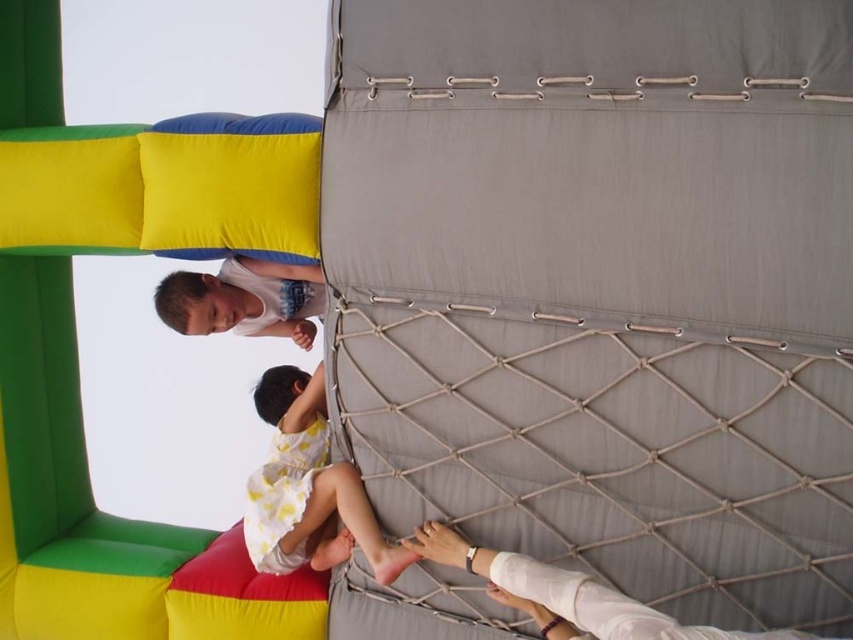
You are a parent observing your children playing at the amusement park. You see the white cotton dress at lower center and the matte white shirt at upper left. Which child is closer to you?

The white cotton dress at lower center is closer to you since it is only 10.16 inches away from the matte white shirt at upper left, indicating proximity in the scene.

You are standing at the point marked as point (354, 483) in the amusement park scene. The climbing net is 1.5 meters wide. Can you safely step onto the climbing net from your current position?

The distance from point (354, 483) to the camera is 1.86 meters. Since the climbing net is 1.5 meters wide, stepping onto it from this position would require reaching 1.86 meters away, which is beyond the net width. Therefore, it might not be safe to step onto the climbing net from this position.

You are a photographer trying to capture a candid shot of the two children. You want to ensure the white cotton dress at lower center and the white bandaged arm at center are both visible in the frame. Based on their positions, which child should you focus on first to include both in the shot?

The white cotton dress at lower center is to the left of the white bandaged arm at center, so focusing on the child in the white cotton dress at lower center first would allow you to frame both children in the shot since they are positioned side by side with the dress on the left and the bandaged arm on the right.